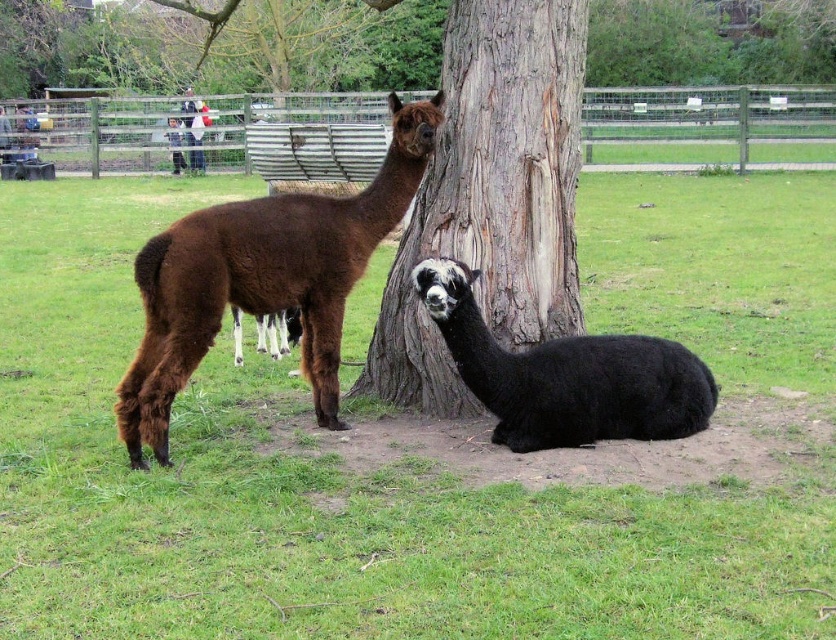
Does point (515, 292) lie behind point (190, 157)?

That is False.

Where is `brown rough bark at center`? The height and width of the screenshot is (640, 836). brown rough bark at center is located at coordinates (492, 196).

Can you confirm if brown rough bark at center is smaller than black woolly alpaca at lower center?

Incorrect, brown rough bark at center is not smaller in size than black woolly alpaca at lower center.

Can you confirm if brown rough bark at center is shorter than black woolly alpaca at lower center?

No.

Locate an element on the screen. The width and height of the screenshot is (836, 640). brown rough bark at center is located at coordinates (492, 196).

This screenshot has height=640, width=836. I want to click on brown rough bark at center, so click(492, 196).

Is point (151, 276) more distant than point (556, 353)?

No, (151, 276) is in front of (556, 353).

Can you confirm if brown woolly alpaca at left is thinner than black woolly alpaca at lower center?

No, brown woolly alpaca at left is not thinner than black woolly alpaca at lower center.

Where is `brown woolly alpaca at left`? Image resolution: width=836 pixels, height=640 pixels. brown woolly alpaca at left is located at coordinates (263, 278).